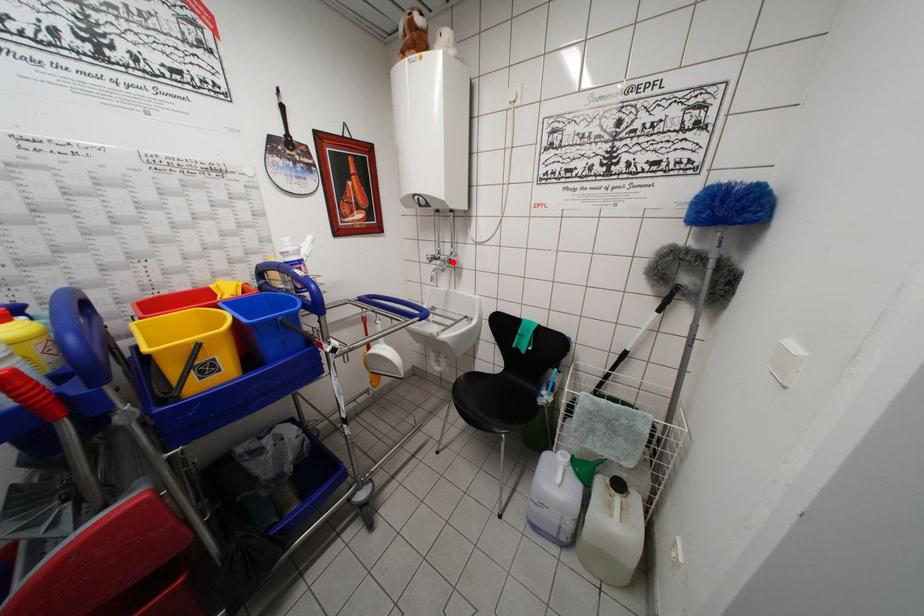
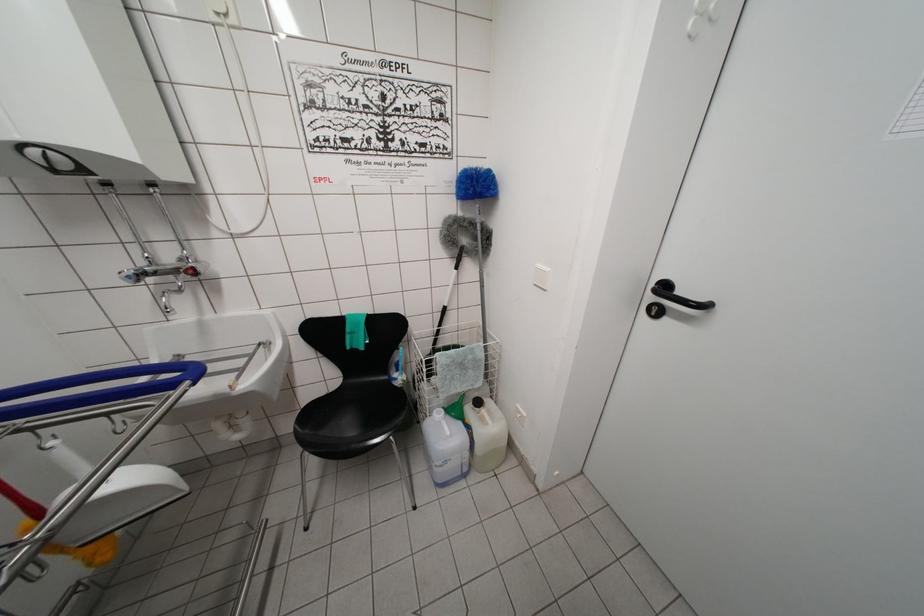
Where in the second image is the point corresponding to the highlighted location from the first image?

(193, 270)